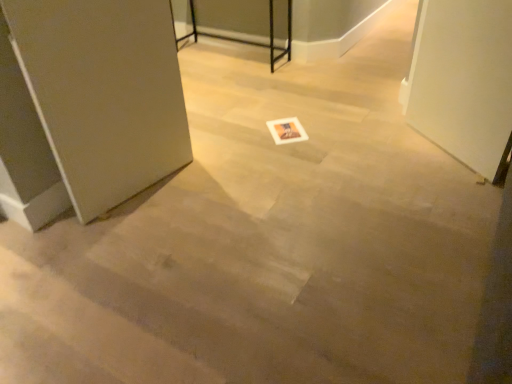
You are a GUI agent. You are given a task and a screenshot of the screen. Output one action in this format:
    pyautogui.click(x=<x>, y=<y>)
    Task: Click on the vacant space that is in between satin silver door at left and white paper postcard at center
    The height and width of the screenshot is (384, 512).
    Given the screenshot: What is the action you would take?
    pyautogui.click(x=220, y=161)